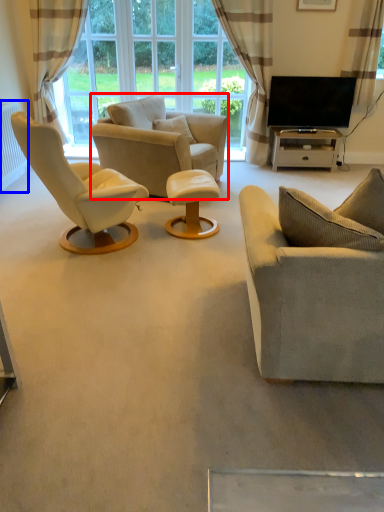
Question: Among these objects, which one is farthest to the camera, chair (highlighted by a red box) or radiator (highlighted by a blue box)?

Choices:
 (A) chair
 (B) radiator

Answer: (B)